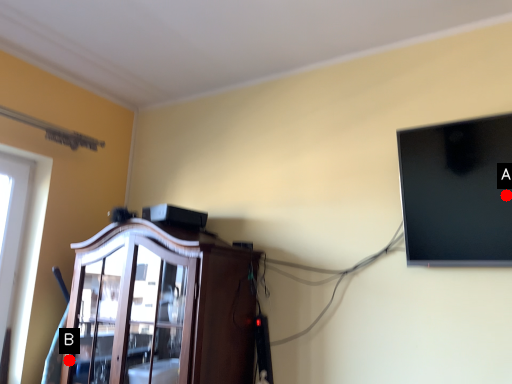
Question: Two points are circled on the image, labeled by A and B beside each circle. Which of the following is the closest to the observer?

Choices:
 (A) A is closer
 (B) B is closer

Answer: (A)